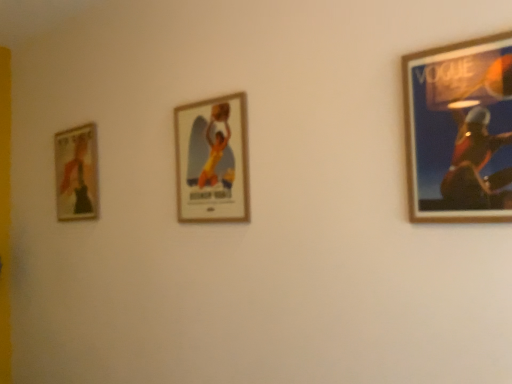
Question: Is wooden frame at right, which is the 1th picture frame in right-to-left order, taller than wooden framed poster at center, the 2th picture frame in the left-to-right sequence?

Choices:
 (A) no
 (B) yes

Answer: (A)

Question: Is wooden frame at right, which is the 1th picture frame in right-to-left order, at the left side of wooden framed poster at center, the 2th picture frame in the left-to-right sequence?

Choices:
 (A) yes
 (B) no

Answer: (B)

Question: From a real-world perspective, is wooden frame at right, which is the 3th picture frame from back to front, beneath wooden framed poster at center, the 2th picture frame in the left-to-right sequence?

Choices:
 (A) yes
 (B) no

Answer: (A)

Question: Is the position of wooden frame at right, the 1th picture frame when ordered from front to back, less distant than that of wooden framed poster at center, acting as the second picture frame starting from the front?

Choices:
 (A) yes
 (B) no

Answer: (A)

Question: Is wooden frame at right, the 1th picture frame when ordered from front to back, touching wooden framed poster at center, which ranks as the 2th picture frame in right-to-left order?

Choices:
 (A) no
 (B) yes

Answer: (A)

Question: Can you confirm if wooden frame at right, the 1th picture frame when ordered from front to back, is shorter than wooden framed poster at center, which ranks as the 2th picture frame in right-to-left order?

Choices:
 (A) yes
 (B) no

Answer: (A)

Question: Would you say wooden framed poster at center, acting as the second picture frame starting from the front, is outside wooden frame at right, which is the 1th picture frame in right-to-left order?

Choices:
 (A) no
 (B) yes

Answer: (B)

Question: Does wooden framed poster at center, acting as the second picture frame starting from the front, have a smaller size compared to wooden frame at right, the 1th picture frame when ordered from front to back?

Choices:
 (A) no
 (B) yes

Answer: (A)

Question: Can wooden frame at right, which is the 1th picture frame in right-to-left order, be found inside wooden framed poster at center, the 2th picture frame in the left-to-right sequence?

Choices:
 (A) yes
 (B) no

Answer: (B)

Question: From the image's perspective, is wooden framed poster at center, which ranks as the 2th picture frame in right-to-left order, located beneath wooden frame at right, acting as the 3th picture frame starting from the left?

Choices:
 (A) no
 (B) yes

Answer: (B)

Question: Is wooden framed poster at center, the 2th picture frame in the left-to-right sequence, closer to the viewer compared to wooden frame at right, acting as the 3th picture frame starting from the left?

Choices:
 (A) yes
 (B) no

Answer: (B)

Question: Does wooden framed poster at center, the 2th picture frame in the left-to-right sequence, have a greater width compared to wooden frame at right, the 1th picture frame when ordered from front to back?

Choices:
 (A) no
 (B) yes

Answer: (B)

Question: From a real-world perspective, is wooden framed poster at center, the 2th picture frame in the left-to-right sequence, positioned over matte gold picture frame at left, placed as the 3th picture frame when sorted from right to left, based on gravity?

Choices:
 (A) no
 (B) yes

Answer: (A)